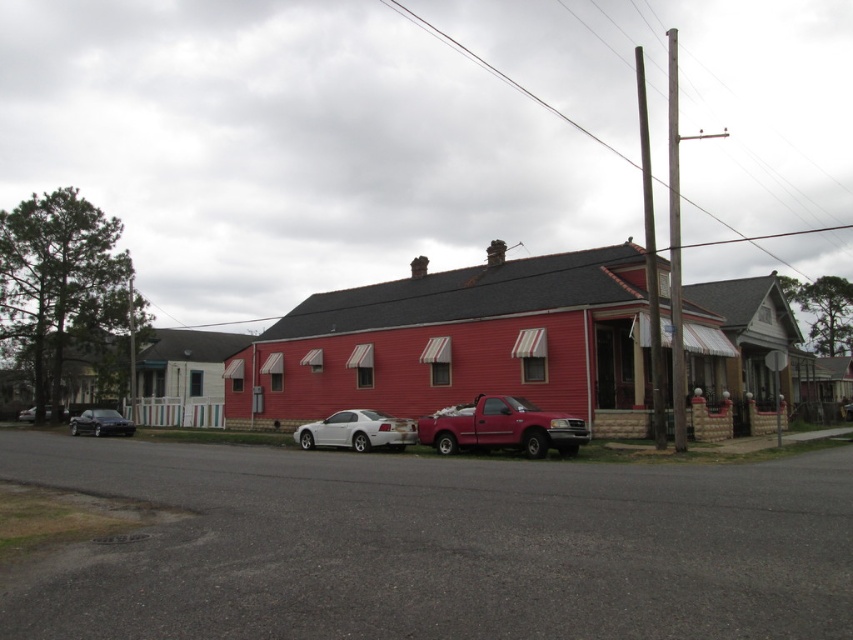
You are standing at the point marked as point (357, 429) on the image. What object is exactly at that point?

The white glossy car at center is located at point (357, 429).

From the picture: You are a pedestrian standing on the residential street and want to cross to the sidewalk on the other side. There are two shiny black sedans. Which one is closer to you, the shiny black sedan at lower left or the shiny black sedan at left?

The shiny black sedan at lower left is closer to you because it is in front of the shiny black sedan at left.